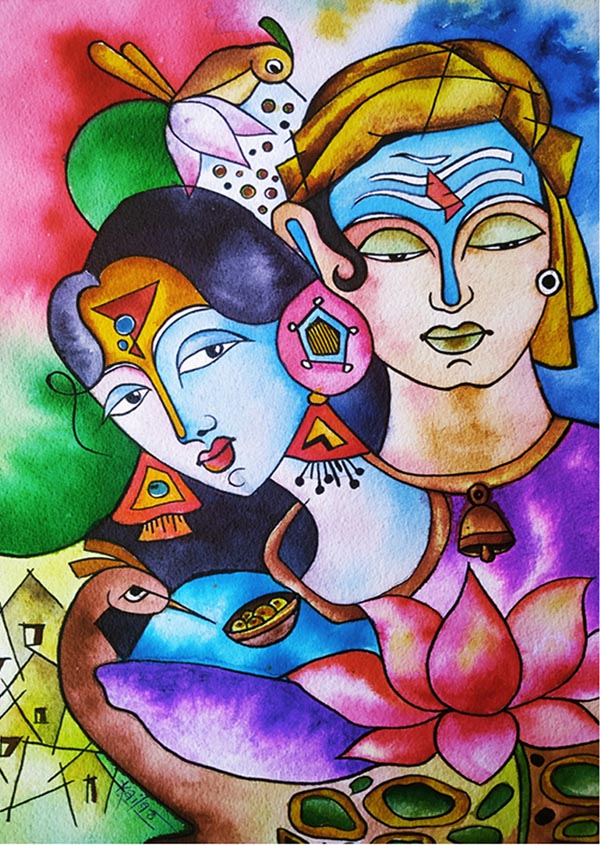
The image size is (600, 845). I want to click on bowl, so click(268, 631).